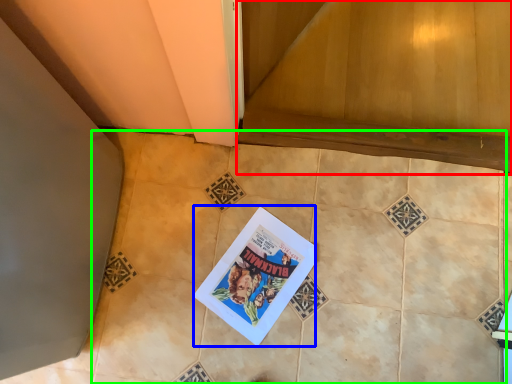
Question: Considering the real-world distances, which object is closest to stairwell (highlighted by a red box)? comic book (highlighted by a blue box) or ceramic tile (highlighted by a green box).

Choices:
 (A) comic book
 (B) ceramic tile

Answer: (B)